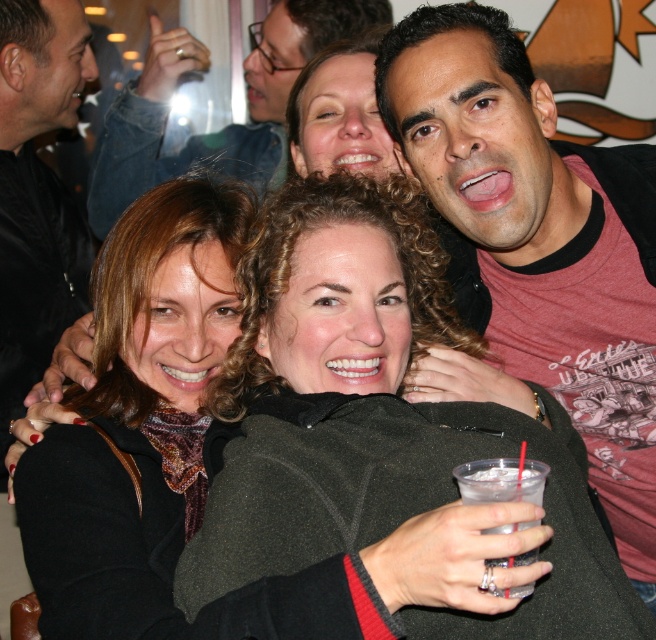
Question: Among these points, which one is farthest from the camera?

Choices:
 (A) (483, 70)
 (B) (310, 4)

Answer: (B)

Question: Is black leather jacket at upper left to the left of matte black jacket at upper center from the viewer's perspective?

Choices:
 (A) yes
 (B) no

Answer: (A)

Question: Which of the following is the closest to the observer?

Choices:
 (A) (501, 460)
 (B) (146, 316)
 (C) (18, 268)

Answer: (A)

Question: Where is matte red shirt at upper right located in relation to black leather jacket at upper left in the image?

Choices:
 (A) left
 (B) right

Answer: (B)

Question: Which of the following is the farthest from the observer?

Choices:
 (A) (480, 243)
 (B) (207, 248)
 (C) (119, 168)

Answer: (C)

Question: Does matte red shirt at upper right appear over matte black scarf at center?

Choices:
 (A) no
 (B) yes

Answer: (B)